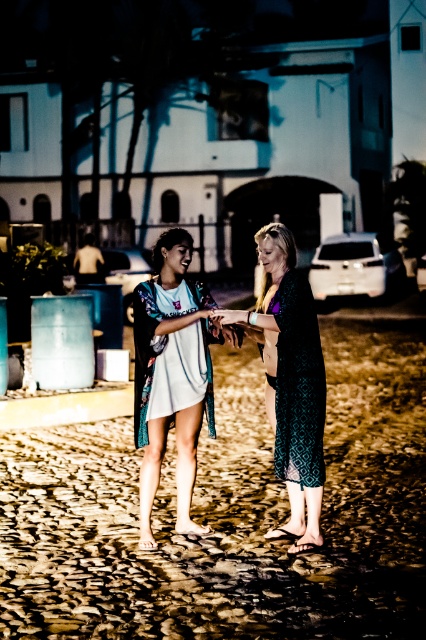
You are a photographer trying to capture a clear shot of the dark green patterned dress at center and the matte black phone at center. Since both are at the center, which object should you focus on first to ensure it appears sharp in the photo?

The dark green patterned dress at center is closer to the viewer than the matte black phone at center, so you should focus on the dark green patterned dress at center first to ensure it appears sharp.

You are a photographer trying to capture a clear shot of the matte black hair at center without the white matte dress at center blocking it. What adjustment should you make to your camera angle?

The white matte dress at center is in front of the matte black hair at center, so you should adjust your camera angle to move behind the white matte dress at center to ensure the matte black hair at center is visible without obstruction.